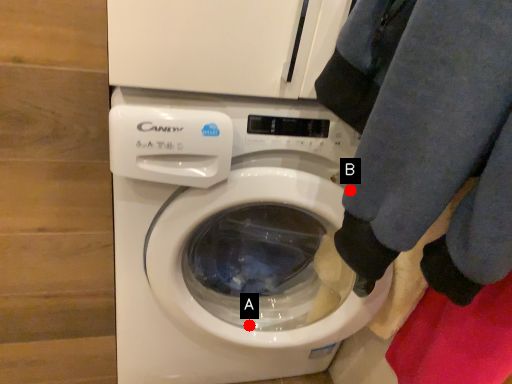
Question: Two points are circled on the image, labeled by A and B beside each circle. Which of the following is the closest to the observer?

Choices:
 (A) A is closer
 (B) B is closer

Answer: (B)